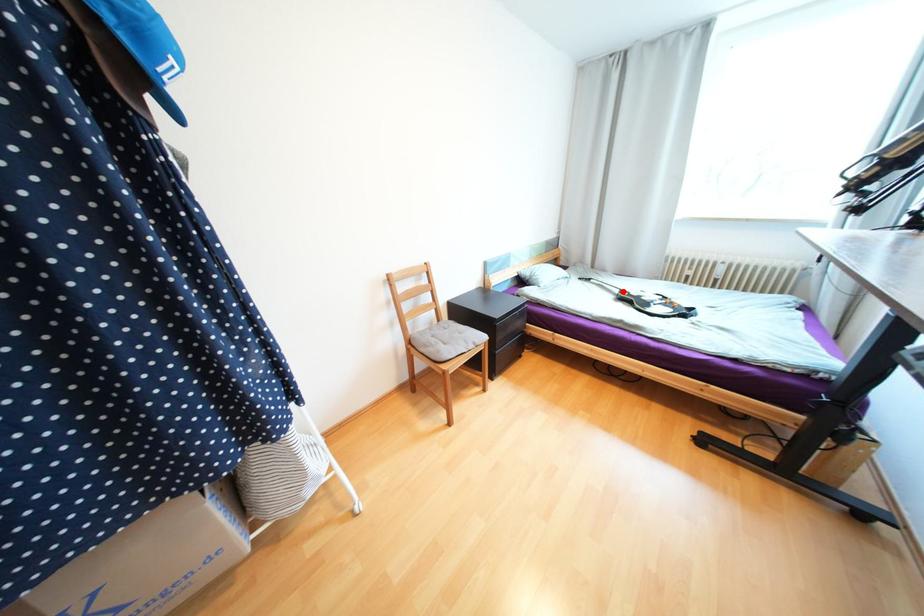
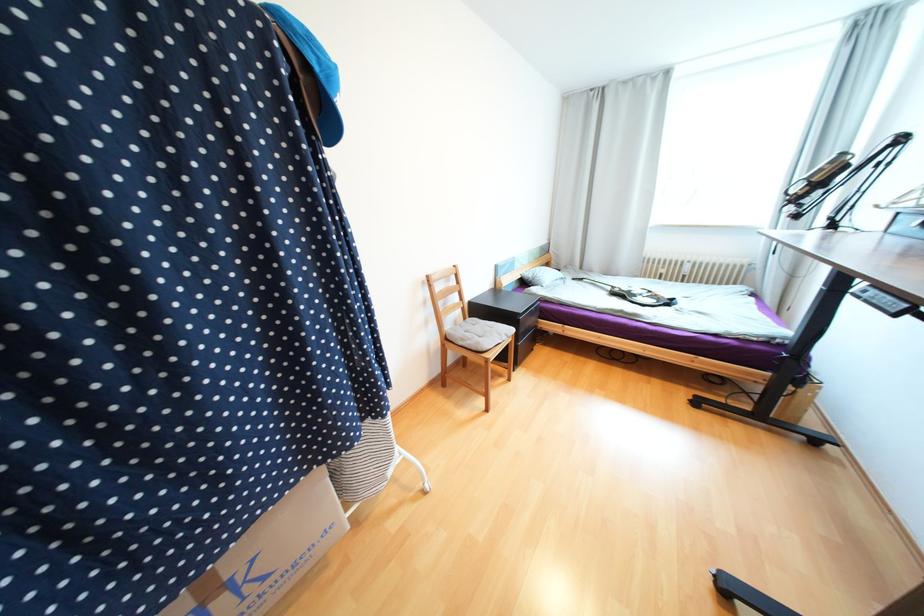
Find the pixel in the second image that matches the highlighted location in the first image.

(614, 288)